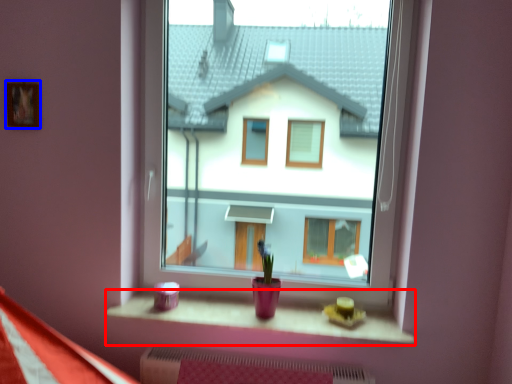
Question: Which object is further to the camera taking this photo, window sill (highlighted by a red box) or picture frame (highlighted by a blue box)?

Choices:
 (A) window sill
 (B) picture frame

Answer: (B)